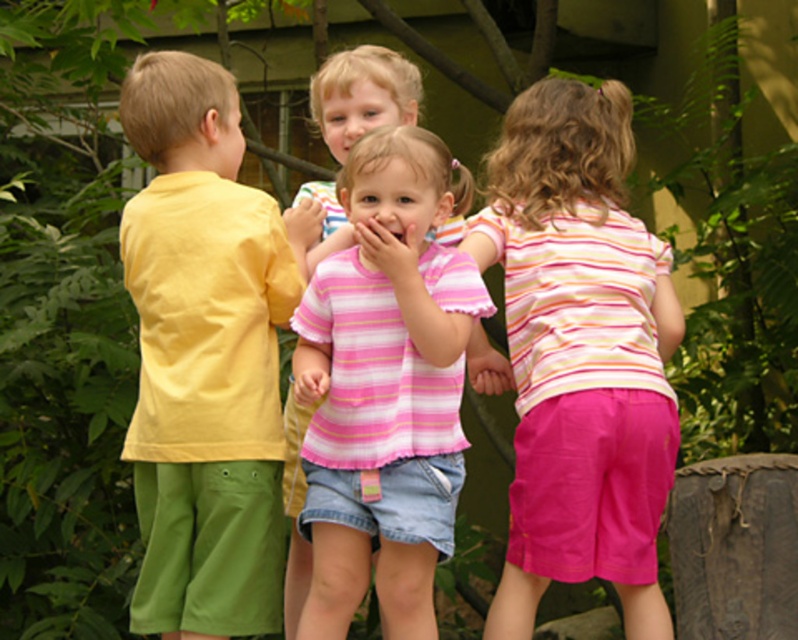
Question: In this image, where is yellow cotton shirt at left located relative to pink striped shirt at center?

Choices:
 (A) below
 (B) above

Answer: (B)

Question: Considering the real-world distances, which object is closest to the pink cotton shorts at right?

Choices:
 (A) yellow cotton shirt at left
 (B) pink striped shirt at center

Answer: (B)

Question: Among these points, which one is farthest from the camera?

Choices:
 (A) (423, 280)
 (B) (283, 237)

Answer: (B)

Question: Which point is farther to the camera?

Choices:
 (A) (516, 593)
 (B) (306, 385)

Answer: (A)

Question: Is yellow cotton shirt at left thinner than pink cotton shorts at right?

Choices:
 (A) no
 (B) yes

Answer: (B)

Question: Can you confirm if yellow cotton shirt at left is smaller than pink cotton shorts at right?

Choices:
 (A) no
 (B) yes

Answer: (B)